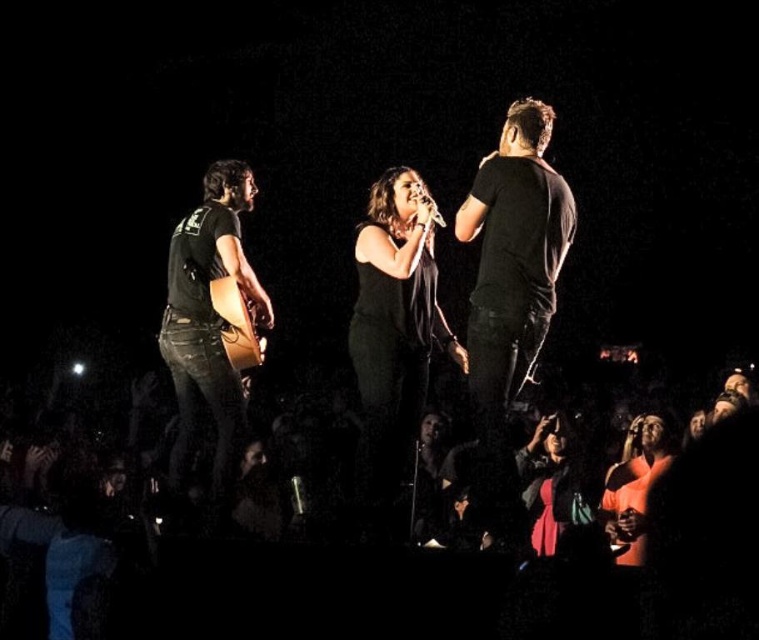
Can you confirm if black leather guitar at left is positioned to the left of metallic silver microphone at center?

Indeed, black leather guitar at left is positioned on the left side of metallic silver microphone at center.

Is black leather guitar at left wider than metallic silver microphone at center?

Yes, black leather guitar at left is wider than metallic silver microphone at center.

Is point (250, 184) farther from camera compared to point (424, 198)?

Yes, point (250, 184) is farther from viewer.

At what (x,y) coordinates should I click in order to perform the action: click on black leather guitar at left. Please return your answer as a coordinate pair (x, y). The image size is (759, 640). Looking at the image, I should click on (209, 323).

Image resolution: width=759 pixels, height=640 pixels. Identify the location of velvet red dress at lower right. (550, 484).

Who is positioned more to the left, velvet red dress at lower right or metallic silver microphone at center?

Positioned to the left is metallic silver microphone at center.

Is point (537, 524) closer to camera compared to point (436, 220)?

That is False.

Where is `velvet red dress at lower right`? velvet red dress at lower right is located at coordinates (550, 484).

Is point (175, 468) positioned behind point (263, 346)?

Yes, point (175, 468) is behind point (263, 346).

Does black leather guitar at left have a lesser height compared to brown wooden guitar at center?

No.

You are a GUI agent. You are given a task and a screenshot of the screen. Output one action in this format:
    pyautogui.click(x=<x>, y=<y>)
    Task: Click on the black leather guitar at left
    Image resolution: width=759 pixels, height=640 pixels.
    Given the screenshot: What is the action you would take?
    pyautogui.click(x=209, y=323)

At what (x,y) coordinates should I click in order to perform the action: click on black leather guitar at left. Please return your answer as a coordinate pair (x, y). Looking at the image, I should click on (209, 323).